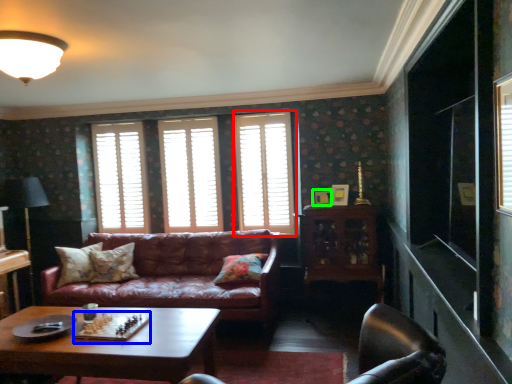
Question: Estimate the real-world distances between objects in this image. Which object is farther from window (highlighted by a red box), board game (highlighted by a blue box) or picture frame (highlighted by a green box)?

Choices:
 (A) board game
 (B) picture frame

Answer: (A)